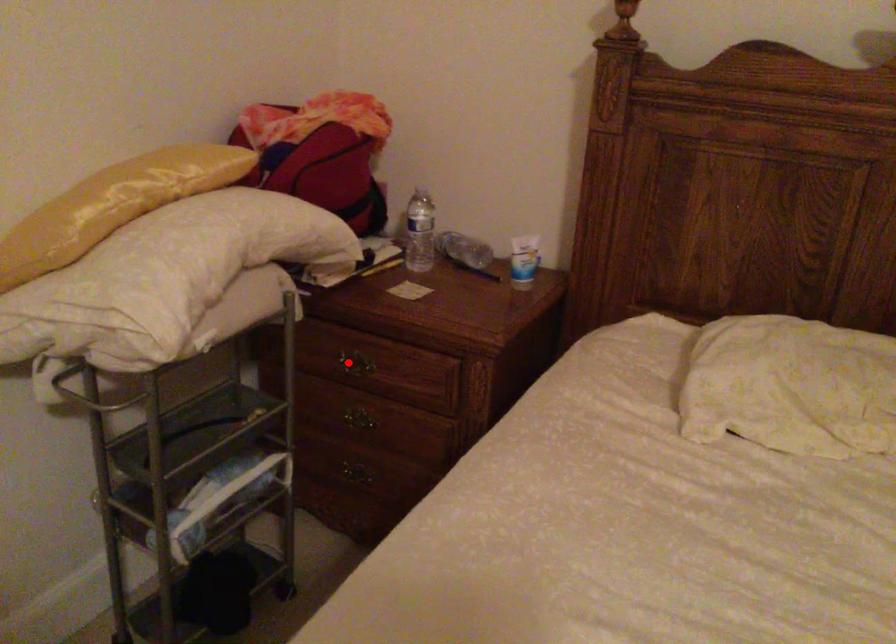
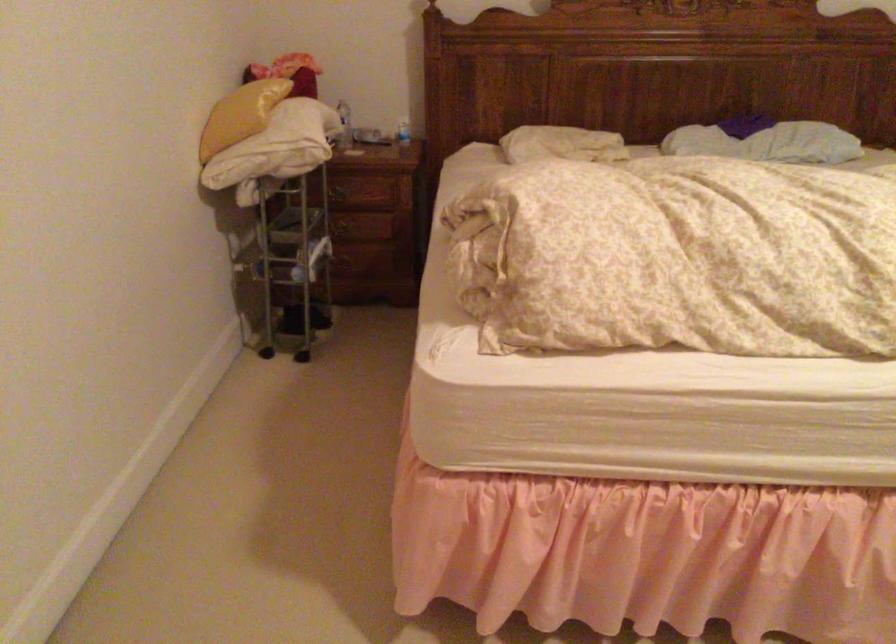
Question: I am providing you with two images of the same scene from different viewpoints. In image1, a red point is highlighted. Considering the same 3D point in image2, which of the following is correct?

Choices:
 (A) It is closer
 (B) It is farther

Answer: (B)